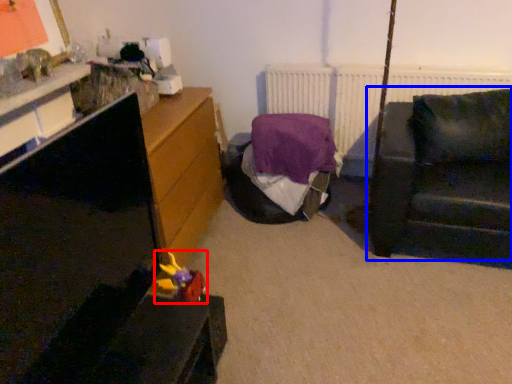
Question: Which point is closer to the camera, toy (highlighted by a red box) or studio couch (highlighted by a blue box)?

Choices:
 (A) toy
 (B) studio couch

Answer: (A)